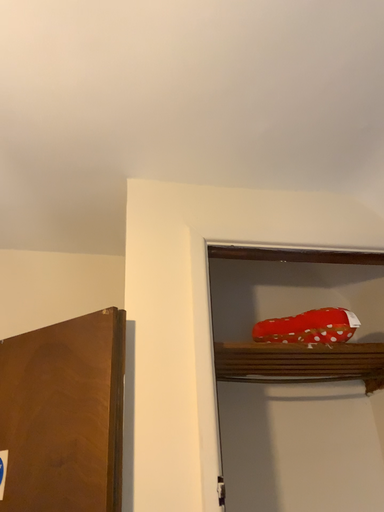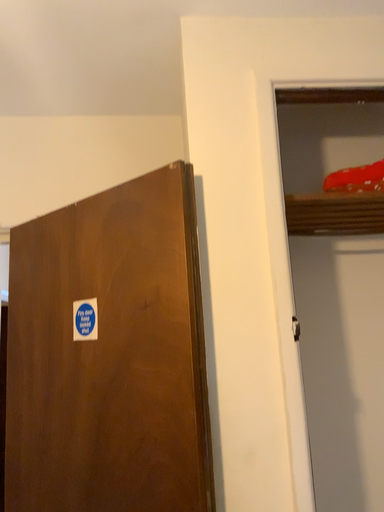
Question: How did the camera likely rotate when shooting the video?

Choices:
 (A) rotated upward
 (B) rotated downward

Answer: (B)